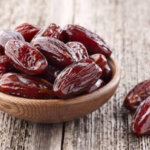
At what (x,y) coordinates should I click in order to perform the action: click on circular pattern on bowl. Please return your answer as a coordinate pair (x, y). The width and height of the screenshot is (150, 150). Looking at the image, I should click on coord(9,106).